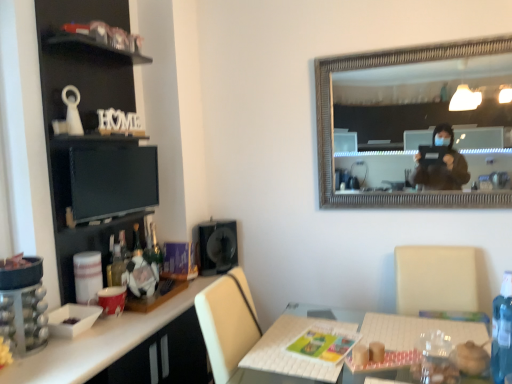
From the picture: Measure the distance between point (169, 317) and camera.

A distance of 5.84 feet exists between point (169, 317) and camera.

You are a GUI agent. You are given a task and a screenshot of the screen. Output one action in this format:
    pyautogui.click(x=<x>, y=<y>)
    Task: Click on the black matte speaker at center
    
    Given the screenshot: What is the action you would take?
    coord(217,246)

At what (x,y) coordinates should I click in order to perform the action: click on clear plastic bottle at lower right. Please return your answer as a coordinate pair (x, y). Looking at the image, I should click on (502, 331).

Find the location of a particular element. Image resolution: width=512 pixels, height=384 pixels. white glossy desk at lower left is located at coordinates (98, 344).

In the scene shown: Is black matte speaker at center next to black glossy computer monitor at upper left and touching it?

They are not placed beside each other.

Between point (225, 265) and point (127, 171), which one is positioned behind?

Point (225, 265)

You are a GUI agent. You are given a task and a screenshot of the screen. Output one action in this format:
    pyautogui.click(x=<x>, y=<y>)
    Task: Click on the speaker that is behind the black glossy computer monitor at upper left
    
    Given the screenshot: What is the action you would take?
    pyautogui.click(x=217, y=246)

How far apart are black matte speaker at center and black glossy computer monitor at upper left?

black matte speaker at center is 56.58 centimeters from black glossy computer monitor at upper left.

Is white glossy desk at lower left at the back of black glossy computer monitor at upper left?

black glossy computer monitor at upper left is not turned away from white glossy desk at lower left.

Does black glossy computer monitor at upper left touch white glossy desk at lower left?

There is a gap between black glossy computer monitor at upper left and white glossy desk at lower left.

In order to click on computer monitor that appears above the white glossy desk at lower left (from the image's perspective) in this screenshot , I will do (112, 181).

Is black glossy computer monitor at upper left wider or thinner than white glossy desk at lower left?

Clearly, black glossy computer monitor at upper left has less width compared to white glossy desk at lower left.

Based on the photo, does black matte speaker at center have a larger size compared to black matte cabinet at left?

Incorrect, black matte speaker at center is not larger than black matte cabinet at left.

What are the coordinates of `cabinetry above the black matte speaker at center (from the image's perspective)` in the screenshot? It's located at (92, 135).

Are black matte speaker at center and black matte cabinet at left beside each other?

No.

From the image's perspective, between clear plastic bottle at lower right and white glossy desk at lower left, who is located below?

white glossy desk at lower left appears lower in the image.

Considering the sizes of clear plastic bottle at lower right and white glossy desk at lower left in the image, is clear plastic bottle at lower right taller or shorter than white glossy desk at lower left?

In the image, clear plastic bottle at lower right appears to be shorter than white glossy desk at lower left.

What's the angular difference between clear plastic bottle at lower right and white glossy desk at lower left's facing directions?

89.7 degrees separate the facing orientations of clear plastic bottle at lower right and white glossy desk at lower left.

Does point (507, 298) come closer to viewer compared to point (174, 304)?

Yes, it is.

Is white glossy desk at lower left turned away from black matte speaker at center?

That's not correct — white glossy desk at lower left is not looking away from black matte speaker at center.

From a real-world perspective, is white glossy desk at lower left above or below black matte speaker at center?

In terms of real-world spatial position, white glossy desk at lower left is below black matte speaker at center.

Is white glossy desk at lower left further to camera compared to black matte speaker at center?

No, the depth of white glossy desk at lower left is less than that of black matte speaker at center.

Based on the photo, from the image's perspective, is clear plastic bottle at lower right below black glossy computer monitor at upper left?

Yes, from the image's perspective, clear plastic bottle at lower right is below black glossy computer monitor at upper left.

Is clear plastic bottle at lower right beside black glossy computer monitor at upper left?

No, clear plastic bottle at lower right is not making contact with black glossy computer monitor at upper left.

From a real-world perspective, relative to black glossy computer monitor at upper left, is clear plastic bottle at lower right vertically above or below?

In terms of real-world spatial position, clear plastic bottle at lower right is below black glossy computer monitor at upper left.

Considering the sizes of objects clear plastic bottle at lower right and black glossy computer monitor at upper left in the image provided, who is wider, clear plastic bottle at lower right or black glossy computer monitor at upper left?

clear plastic bottle at lower right is wider.

From a real-world perspective, is black glossy computer monitor at upper left physically above black matte speaker at center?

Indeed, from a real-world perspective, black glossy computer monitor at upper left stands above black matte speaker at center.

Can you confirm if black glossy computer monitor at upper left is positioned to the left of black matte speaker at center?

Indeed, black glossy computer monitor at upper left is positioned on the left side of black matte speaker at center.

From the image's perspective, is black glossy computer monitor at upper left above or below black matte speaker at center?

Clearly, from the image's perspective, black glossy computer monitor at upper left is above black matte speaker at center.

Between black glossy computer monitor at upper left and black matte speaker at center, which one has smaller width?

Thinner between the two is black glossy computer monitor at upper left.

At what (x,y) coordinates should I click in order to perform the action: click on speaker on the right of black glossy computer monitor at upper left. Please return your answer as a coordinate pair (x, y). The width and height of the screenshot is (512, 384). Looking at the image, I should click on (217, 246).

You are a GUI agent. You are given a task and a screenshot of the screen. Output one action in this format:
    pyautogui.click(x=<x>, y=<y>)
    Task: Click on the desk lying below the black glossy computer monitor at upper left (from the image's perspective)
    The image size is (512, 384).
    Given the screenshot: What is the action you would take?
    pyautogui.click(x=98, y=344)

From the image, which object appears to be nearer to white glossy desk at lower left, black matte speaker at center or black glossy computer monitor at upper left?

black glossy computer monitor at upper left is closer to white glossy desk at lower left.

Which object lies nearer to the anchor point black glossy computer monitor at upper left, black matte speaker at center or black matte cabinet at left?

black matte cabinet at left is positioned closer to the anchor black glossy computer monitor at upper left.

Which object lies further to the anchor point white glossy desk at lower left, clear plastic bottle at lower right or black glossy computer monitor at upper left?

clear plastic bottle at lower right is positioned further to the anchor white glossy desk at lower left.

Estimate the real-world distances between objects in this image. Which object is further from black glossy computer monitor at upper left, clear plastic bottle at lower right or white glossy desk at lower left?

clear plastic bottle at lower right lies further to black glossy computer monitor at upper left than the other object.

Based on their spatial positions, is black matte cabinet at left or black matte speaker at center further from white glossy desk at lower left?

Among the two, black matte cabinet at left is located further to white glossy desk at lower left.

From the image, which object appears to be farther from black matte cabinet at left, clear plastic bottle at lower right or white glossy desk at lower left?

clear plastic bottle at lower right is further to black matte cabinet at left.

In the scene shown: Considering their positions, is white glossy desk at lower left positioned further to clear plastic bottle at lower right than black matte speaker at center?

black matte speaker at center is further to clear plastic bottle at lower right.

When comparing their distances from black matte speaker at center, does black matte cabinet at left or white glossy desk at lower left seem further?

black matte cabinet at left is further to black matte speaker at center.

Where is `desk between black glossy computer monitor at upper left and clear plastic bottle at lower right from left to right`? The height and width of the screenshot is (384, 512). desk between black glossy computer monitor at upper left and clear plastic bottle at lower right from left to right is located at coordinates (98, 344).

Identify the location of speaker located between white glossy desk at lower left and clear plastic bottle at lower right in the left-right direction. (217, 246).

I want to click on speaker located between black matte cabinet at left and clear plastic bottle at lower right in the left-right direction, so click(217, 246).

Identify the location of speaker located between black glossy computer monitor at upper left and clear plastic bottle at lower right in the left-right direction. This screenshot has width=512, height=384. (217, 246).